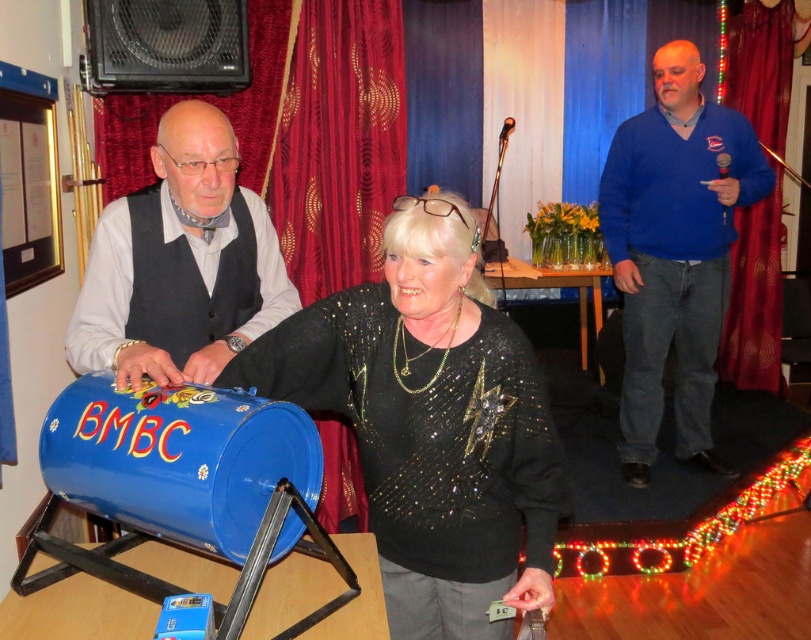
Between point (316, 372) and point (247, 291), which one is positioned behind?

Point (247, 291)

Who is taller, sparkly black sweater at center or brushed metal drum at left?

With more height is sparkly black sweater at center.

Is point (372, 456) less distant than point (222, 160)?

Yes, point (372, 456) is in front of point (222, 160).

You are a GUI agent. You are given a task and a screenshot of the screen. Output one action in this format:
    pyautogui.click(x=<x>, y=<y>)
    Task: Click on the sparkly black sweater at center
    The height and width of the screenshot is (640, 811).
    Given the screenshot: What is the action you would take?
    pyautogui.click(x=430, y=422)

Is sparkly black sweater at center shorter than blue sweater at right?

Indeed, sparkly black sweater at center has a lesser height compared to blue sweater at right.

Which of these two, sparkly black sweater at center or blue sweater at right, stands shorter?

With less height is sparkly black sweater at center.

Is point (491, 531) more distant than point (685, 60)?

No, (491, 531) is closer to viewer.

This screenshot has height=640, width=811. What are the coordinates of `sparkly black sweater at center` in the screenshot? It's located at (430, 422).

Does blue sweater at right have a greater width compared to brushed metal drum at left?

Yes, blue sweater at right is wider than brushed metal drum at left.

Between blue sweater at right and brushed metal drum at left, which one has more height?

blue sweater at right

Where is `blue sweater at right`? The image size is (811, 640). blue sweater at right is located at coordinates (676, 252).